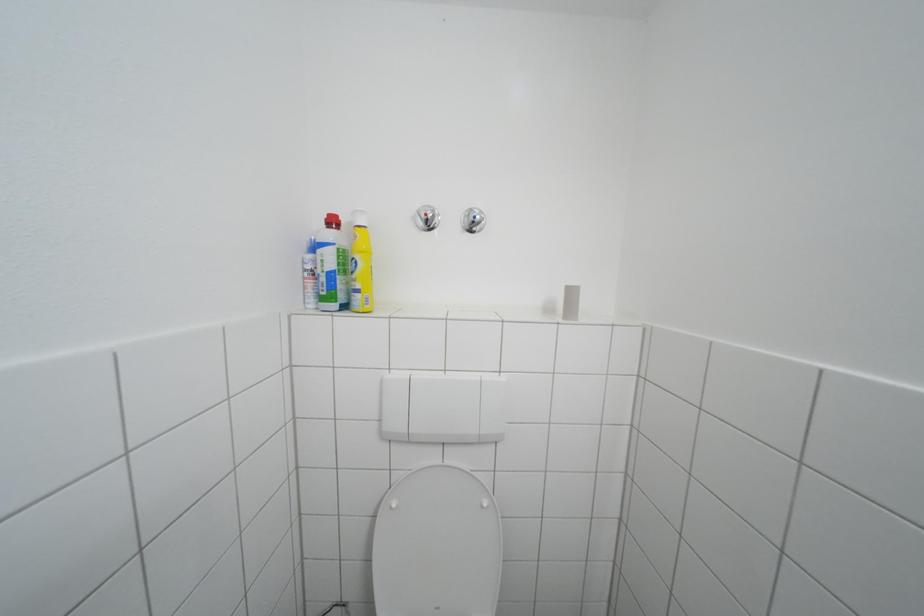
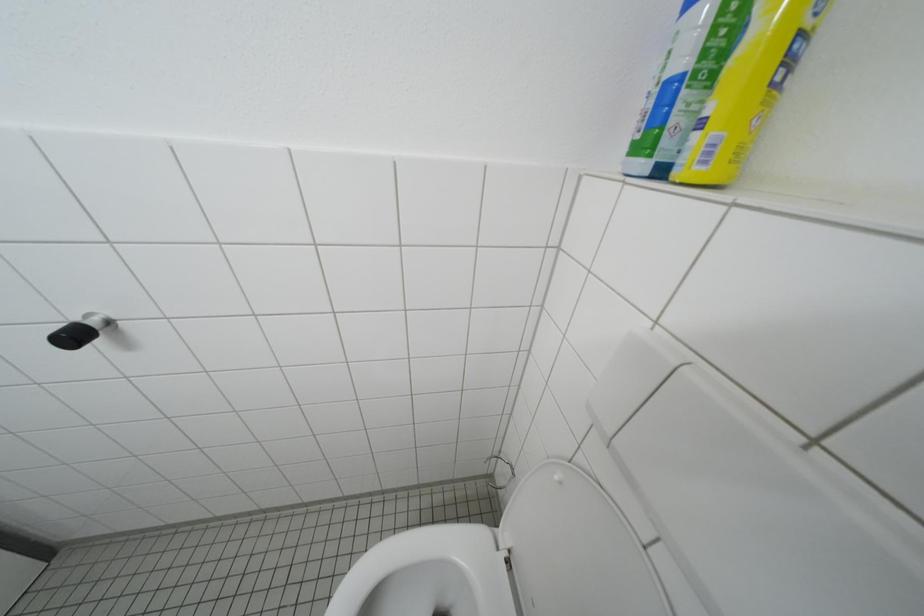
The images are taken continuously from a first-person perspective. In which direction is your viewpoint rotating?

The camera rotated toward left-down.